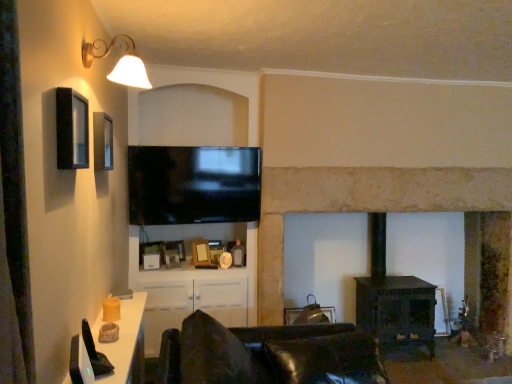
What do you see at coordinates (103, 141) in the screenshot?
I see `matte black picture frame at upper left, the 1th picture frame viewed from the front` at bounding box center [103, 141].

Locate an element on the screen. The height and width of the screenshot is (384, 512). black glossy tv at center is located at coordinates (193, 184).

Find the location of a particular element. white glossy table at lower left is located at coordinates (121, 338).

Where is `wooden picture frame at center, positioned as the second picture frame in front-to-back order`? wooden picture frame at center, positioned as the second picture frame in front-to-back order is located at coordinates (173, 253).

You are a GUI agent. You are given a task and a screenshot of the screen. Output one action in this format:
    pyautogui.click(x=<x>, y=<y>)
    Task: Click on the stone fireplace at center
    
    Given the screenshot: What is the action you would take?
    pyautogui.click(x=368, y=209)

Locate an element on the screen. The height and width of the screenshot is (384, 512). gold metallic wall sconce at upper left is located at coordinates tap(119, 62).

At what (x,y) coordinates should I click in order to perform the action: click on matte black picture frame at upper left, the 1th picture frame viewed from the front. Please return your answer as a coordinate pair (x, y). This screenshot has width=512, height=384. Looking at the image, I should click on (103, 141).

The image size is (512, 384). In order to click on studio couch in front of the wooden picture frame at center, the first picture frame positioned from the bottom in this screenshot , I will do `click(268, 354)`.

Is leather couch at center inside or outside of wooden picture frame at center, the first picture frame positioned from the bottom?

leather couch at center lies outside wooden picture frame at center, the first picture frame positioned from the bottom.

From a real-world perspective, is leather couch at center located beneath wooden picture frame at center, positioned as the second picture frame in front-to-back order?

Yes, from a real-world perspective, leather couch at center is under wooden picture frame at center, positioned as the second picture frame in front-to-back order.

Between leather couch at center and wooden picture frame at center, the second picture frame from the top, which one is positioned in front?

Positioned in front is leather couch at center.

How different are the orientations of matte black picture frame at upper left, the 1th picture frame viewed from the front, and white glossy table at lower left in degrees?

There is a 0.586-degree angle between the facing directions of matte black picture frame at upper left, the 1th picture frame viewed from the front, and white glossy table at lower left.

At what (x,y) coordinates should I click in order to perform the action: click on the 2nd picture frame located above the white glossy table at lower left (from a real-world perspective). Please return your answer as a coordinate pair (x, y). The image size is (512, 384). Looking at the image, I should click on (103, 141).

Which is correct: matte black picture frame at upper left, which is the 2th picture frame in back-to-front order, is inside white glossy table at lower left, or outside of it?

matte black picture frame at upper left, which is the 2th picture frame in back-to-front order, lies outside white glossy table at lower left.

Can you confirm if matte black picture frame at upper left, which ranks as the first picture frame in top-to-bottom order, is bigger than white glossy table at lower left?

Actually, matte black picture frame at upper left, which ranks as the first picture frame in top-to-bottom order, might be smaller than white glossy table at lower left.

Is black glossy tv at center wider or thinner than stone fireplace at center?

black glossy tv at center is thinner than stone fireplace at center.

From the image's perspective, is black glossy tv at center located beneath stone fireplace at center?

Incorrect, from the image's perspective, black glossy tv at center is higher than stone fireplace at center.

Considering the sizes of objects black glossy tv at center and stone fireplace at center in the image provided, who is taller, black glossy tv at center or stone fireplace at center?

Standing taller between the two is stone fireplace at center.

Locate an element on the screen. fireplace to the right of gold metallic wall sconce at upper left is located at coordinates (368, 209).

Consider the image. Is the position of stone fireplace at center less distant than that of gold metallic wall sconce at upper left?

No, stone fireplace at center is further to the viewer.

Which is correct: stone fireplace at center is inside gold metallic wall sconce at upper left, or outside of it?

stone fireplace at center is not inside gold metallic wall sconce at upper left, it's outside.

Considering the points (56, 100) and (390, 186), which point is in front, point (56, 100) or point (390, 186)?

Positioned in front is point (56, 100).

Is matte glass window at upper left directly adjacent to stone fireplace at center?

No, matte glass window at upper left is not in contact with stone fireplace at center.

The height and width of the screenshot is (384, 512). I want to click on fireplace that is behind the matte glass window at upper left, so click(x=368, y=209).

In the scene shown: Between matte glass window at upper left and stone fireplace at center, which one has larger size?

stone fireplace at center.

How far apart are matte glass window at upper left and leather couch at center?

A distance of 1.11 meters exists between matte glass window at upper left and leather couch at center.

Locate an element on the screen. studio couch that is below the matte glass window at upper left (from the image's perspective) is located at coordinates (268, 354).

Looking at the image, does matte glass window at upper left seem bigger or smaller compared to leather couch at center?

Clearly, matte glass window at upper left is smaller in size than leather couch at center.

From the image's perspective, which one is positioned higher, matte glass window at upper left or leather couch at center?

matte glass window at upper left appears higher in the image.

Between wooden picture frame at center, the 1th picture frame from the back, and stone fireplace at center, which one has larger size?

stone fireplace at center is bigger.

In the scene shown: Considering the sizes of objects wooden picture frame at center, the second picture frame from the top, and stone fireplace at center in the image provided, who is wider, wooden picture frame at center, the second picture frame from the top, or stone fireplace at center?

With larger width is stone fireplace at center.

Between wooden picture frame at center, the 1th picture frame from the back, and stone fireplace at center, which one is positioned in front?

stone fireplace at center is closer to the camera.

Which is more to the right, wooden picture frame at center, the 1th picture frame from the back, or stone fireplace at center?

stone fireplace at center is more to the right.

Find the location of a particular element. the 1st picture frame above when counting from the leather couch at center (from the image's perspective) is located at coordinates (173, 253).

In the image, there is a matte black picture frame at upper left, which ranks as the first picture frame in top-to-bottom order. At what (x,y) coordinates should I click in order to perform the action: click on table below it (from the image's perspective). Please return your answer as a coordinate pair (x, y). Looking at the image, I should click on (121, 338).

Considering their positions, is stone fireplace at center positioned further to matte black picture frame at upper left, which ranks as the first picture frame in top-to-bottom order, than black glossy tv at center?

Among the two, stone fireplace at center is located further to matte black picture frame at upper left, which ranks as the first picture frame in top-to-bottom order.

Looking at the image, which one is located further to wooden picture frame at center, the 1th picture frame from the back, leather couch at center or matte black picture frame at upper left, the 1th picture frame viewed from the front?

The object further to wooden picture frame at center, the 1th picture frame from the back, is leather couch at center.

Based on the photo, based on their spatial positions, is matte black picture frame at upper left, which is the 2th picture frame in back-to-front order, or stone fireplace at center further from white glossy table at lower left?

stone fireplace at center lies further to white glossy table at lower left than the other object.

Based on their spatial positions, is gold metallic wall sconce at upper left or matte glass window at upper left further from white glossy table at lower left?

The object further to white glossy table at lower left is gold metallic wall sconce at upper left.

When comparing their distances from matte glass window at upper left, does matte black picture frame at upper left, which ranks as the first picture frame in top-to-bottom order, or stone fireplace at center seem closer?

matte black picture frame at upper left, which ranks as the first picture frame in top-to-bottom order.

Based on their spatial positions, is gold metallic wall sconce at upper left or black glossy tv at center further from stone fireplace at center?

Among the two, gold metallic wall sconce at upper left is located further to stone fireplace at center.

From the picture: Which object lies further to the anchor point black glossy tv at center, wooden picture frame at center, the second picture frame from the top, or matte black picture frame at upper left, which is the 2th picture frame in back-to-front order?

Based on the image, matte black picture frame at upper left, which is the 2th picture frame in back-to-front order, appears to be further to black glossy tv at center.

Considering their positions, is stone fireplace at center positioned further to wooden picture frame at center, positioned as the second picture frame in front-to-back order, than gold metallic wall sconce at upper left?

gold metallic wall sconce at upper left is positioned further to the anchor wooden picture frame at center, positioned as the second picture frame in front-to-back order.

Locate an element on the screen. picture frame positioned between matte glass window at upper left and black glossy tv at center from near to far is located at coordinates (103, 141).

Image resolution: width=512 pixels, height=384 pixels. Find the location of `table between gold metallic wall sconce at upper left and leather couch at center vertically`. table between gold metallic wall sconce at upper left and leather couch at center vertically is located at coordinates (121, 338).

At what (x,y) coordinates should I click in order to perform the action: click on light fixture between leather couch at center and stone fireplace at center from front to back. Please return your answer as a coordinate pair (x, y). The height and width of the screenshot is (384, 512). Looking at the image, I should click on (119, 62).

Identify the location of television between matte glass window at upper left and wooden picture frame at center, the 1th picture frame from the back, in the front-back direction. (193, 184).